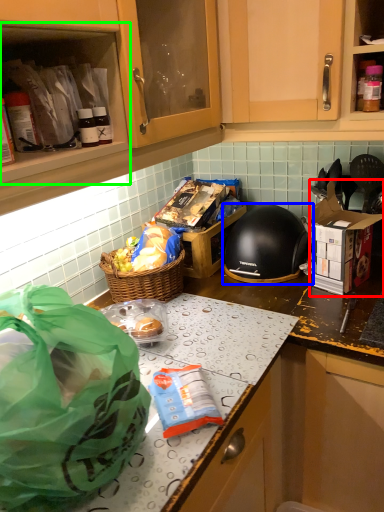
Question: Based on their relative distances, which object is farther from cardboard box (highlighted by a red box)? Choose from helmet (highlighted by a blue box) and cabinetry (highlighted by a green box).

Choices:
 (A) helmet
 (B) cabinetry

Answer: (B)